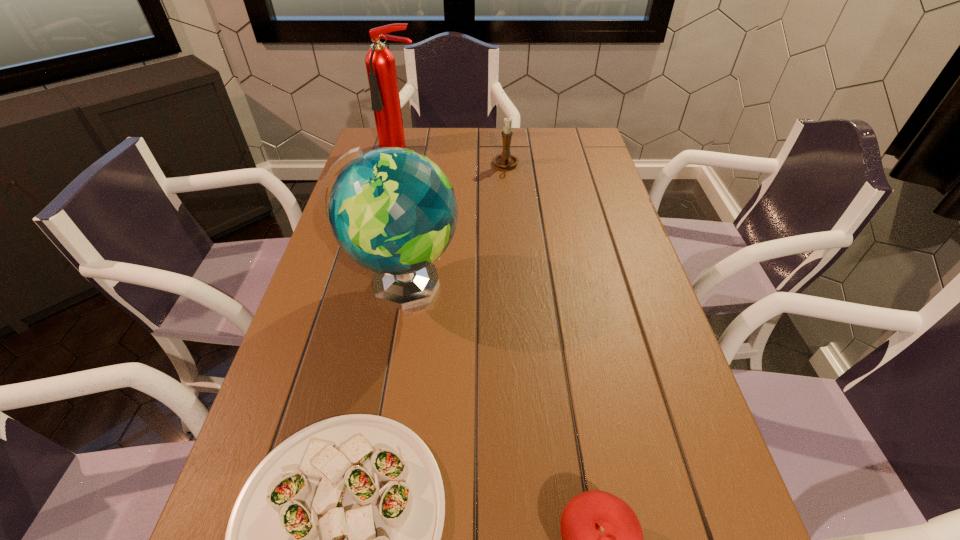
You are a GUI agent. You are given a task and a screenshot of the screen. Output one action in this format:
    pyautogui.click(x=<x>, y=<y>)
    Task: Click on the object at the far left corner
    The width and height of the screenshot is (960, 540).
    Given the screenshot: What is the action you would take?
    pyautogui.click(x=380, y=63)

This screenshot has height=540, width=960. In the image, there is a desktop. What are the coordinates of `vacant space at the left edge` in the screenshot? It's located at (290, 436).

In the image, there is a desktop. Where is `free space at the right edge`? The image size is (960, 540). free space at the right edge is located at coordinates (617, 349).

Find the location of a particular element. blank space at the far right corner of the desktop is located at coordinates (592, 160).

Locate an element on the screen. This screenshot has height=540, width=960. empty space between the candle holder and the fire extinguisher is located at coordinates (453, 158).

Locate an element on the screen. The width and height of the screenshot is (960, 540). free spot between the third tallest object and the fire extinguisher is located at coordinates (453, 158).

You are a GUI agent. You are given a task and a screenshot of the screen. Output one action in this format:
    pyautogui.click(x=<x>, y=<y>)
    Task: Click on the object that ranks as the second closest to the third nearest object
    This screenshot has width=960, height=540.
    Given the screenshot: What is the action you would take?
    pyautogui.click(x=505, y=160)

I want to click on object that stands as the closest to the apple, so click(335, 539).

Where is `free space that satisfies the following two spatial constraints: 1. on the side of the third shortest object with the handle; 2. on the front surface of the third farthest object`? free space that satisfies the following two spatial constraints: 1. on the side of the third shortest object with the handle; 2. on the front surface of the third farthest object is located at coordinates (516, 285).